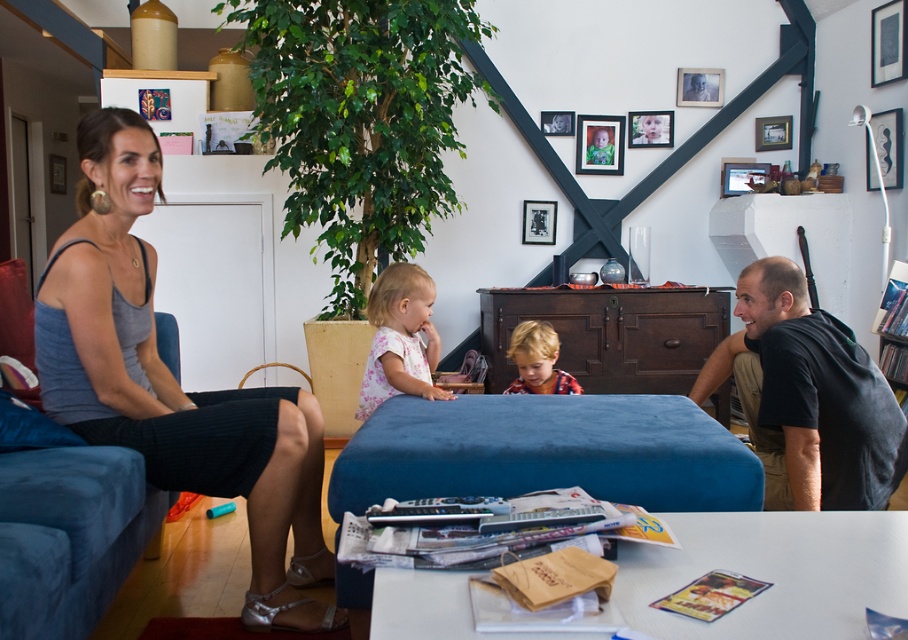
Can you confirm if matte gray tank top at left is wider than floral cotton shirt at center?

Yes.

Between matte gray tank top at left and floral cotton shirt at center, which one appears on the left side from the viewer's perspective?

Positioned to the left is matte gray tank top at left.

Image resolution: width=908 pixels, height=640 pixels. Find the location of `matte gray tank top at left`. matte gray tank top at left is located at coordinates (174, 381).

Where is `matte gray tank top at left`? The image size is (908, 640). matte gray tank top at left is located at coordinates click(x=174, y=381).

Is black cotton shirt at right thinner than floral cotton shirt at center?

No.

Is point (894, 428) positioned after point (364, 365)?

No, it is not.

This screenshot has width=908, height=640. I want to click on black cotton shirt at right, so click(x=806, y=396).

Where is `black cotton shirt at right`? This screenshot has height=640, width=908. black cotton shirt at right is located at coordinates (806, 396).

Between point (801, 502) and point (524, 330), which one is positioned in front?

Point (801, 502) is in front.

The width and height of the screenshot is (908, 640). Identify the location of black cotton shirt at right. [x=806, y=396].